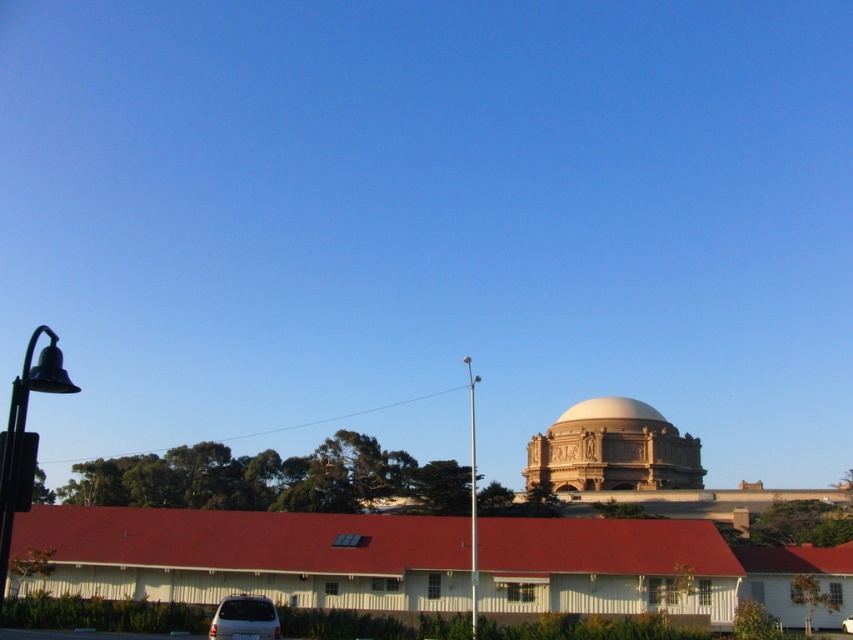
Is black metal bell at left bigger than white matte van at lower center?

Yes, black metal bell at left is bigger than white matte van at lower center.

Between black metal bell at left and white matte van at lower center, which one appears on the right side from the viewer's perspective?

Positioned to the right is white matte van at lower center.

Image resolution: width=853 pixels, height=640 pixels. I want to click on black metal bell at left, so click(x=24, y=436).

Does golden stone dome at center have a lesser width compared to black metal bell at left?

Correct, golden stone dome at center's width is less than black metal bell at left's.

Which is behind, point (653, 467) or point (30, 470)?

Positioned behind is point (653, 467).

The width and height of the screenshot is (853, 640). Identify the location of golden stone dome at center. (612, 449).

Which is more to the left, white smooth dome at center or white metallic pole at center?

white metallic pole at center

Is point (595, 397) in front of point (474, 577)?

No, it is behind (474, 577).

Identify the location of white smooth dome at center. This screenshot has width=853, height=640. (610, 410).